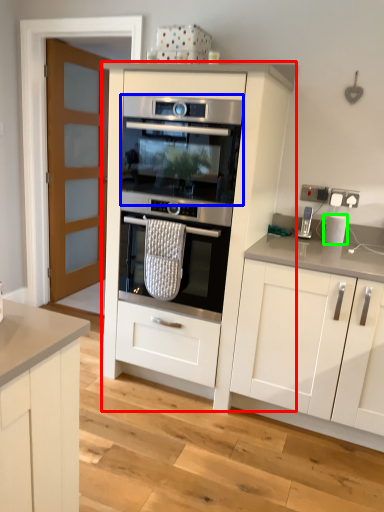
Question: Estimate the real-world distances between objects in this image. Which object is closer to cabinetry (highlighted by a red box), oven (highlighted by a blue box) or kitchen appliance (highlighted by a green box)?

Choices:
 (A) oven
 (B) kitchen appliance

Answer: (A)